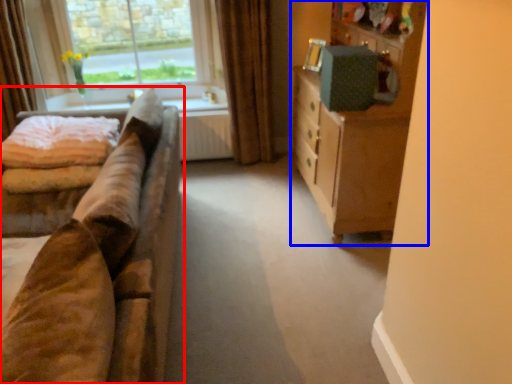
Question: Which point is further to the camera, studio couch (highlighted by a red box) or cabinetry (highlighted by a blue box)?

Choices:
 (A) studio couch
 (B) cabinetry

Answer: (B)